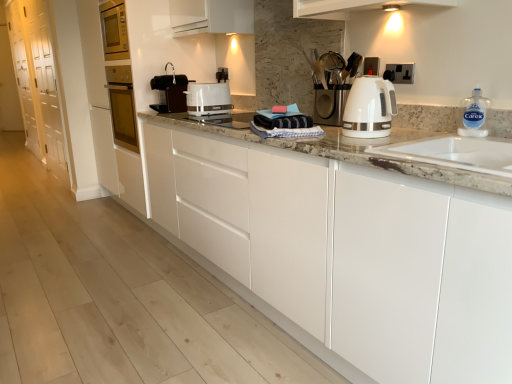
Question: Considering the relative sizes of white glossy cabinet at left, the 1th cabinetry in the left-to-right sequence, and black plastic electric outlet at upper right in the image provided, is white glossy cabinet at left, the 1th cabinetry in the left-to-right sequence, wider than black plastic electric outlet at upper right?

Choices:
 (A) yes
 (B) no

Answer: (A)

Question: Is white glossy cabinet at left, placed as the first cabinetry when sorted from back to front, turned away from black plastic electric outlet at upper right?

Choices:
 (A) no
 (B) yes

Answer: (A)

Question: Is white glossy cabinet at left, the 1th cabinetry in the left-to-right sequence, thinner than black plastic electric outlet at upper right?

Choices:
 (A) yes
 (B) no

Answer: (B)

Question: Is the depth of white glossy cabinet at left, acting as the 2th cabinetry starting from the front, greater than that of black plastic electric outlet at upper right?

Choices:
 (A) yes
 (B) no

Answer: (A)

Question: Is white glossy cabinet at left, acting as the 2th cabinetry starting from the front, closer to the viewer compared to black plastic electric outlet at upper right?

Choices:
 (A) no
 (B) yes

Answer: (A)

Question: Could you tell me if white glossy cabinet at left, placed as the first cabinetry when sorted from back to front, is facing black plastic electric outlet at upper right?

Choices:
 (A) no
 (B) yes

Answer: (A)

Question: Is white glossy cabinet at left, acting as the 2th cabinetry starting from the front, bigger than clear plastic bottle at right?

Choices:
 (A) yes
 (B) no

Answer: (A)

Question: Considering the relative sizes of white glossy cabinet at left, the 1th cabinetry in the left-to-right sequence, and clear plastic bottle at right in the image provided, is white glossy cabinet at left, the 1th cabinetry in the left-to-right sequence, smaller than clear plastic bottle at right?

Choices:
 (A) no
 (B) yes

Answer: (A)

Question: Could clear plastic bottle at right be considered to be inside white glossy cabinet at left, acting as the 2th cabinetry starting from the front?

Choices:
 (A) yes
 (B) no

Answer: (B)

Question: Considering the relative positions of white glossy cabinet at left, acting as the 2th cabinetry starting from the front, and clear plastic bottle at right in the image provided, is white glossy cabinet at left, acting as the 2th cabinetry starting from the front, behind clear plastic bottle at right?

Choices:
 (A) no
 (B) yes

Answer: (B)

Question: From the image's perspective, would you say white glossy cabinet at left, the 1th cabinetry in the left-to-right sequence, is shown under clear plastic bottle at right?

Choices:
 (A) yes
 (B) no

Answer: (B)

Question: Considering the relative sizes of white glossy cabinet at left, acting as the 2th cabinetry starting from the front, and clear plastic bottle at right in the image provided, is white glossy cabinet at left, acting as the 2th cabinetry starting from the front, taller than clear plastic bottle at right?

Choices:
 (A) no
 (B) yes

Answer: (B)

Question: Does white glossy electric kettle at right, marked as the second home appliance in a back-to-front arrangement, come in front of white glossy cabinets at center, marked as the second cabinetry in a left-to-right arrangement?

Choices:
 (A) no
 (B) yes

Answer: (A)